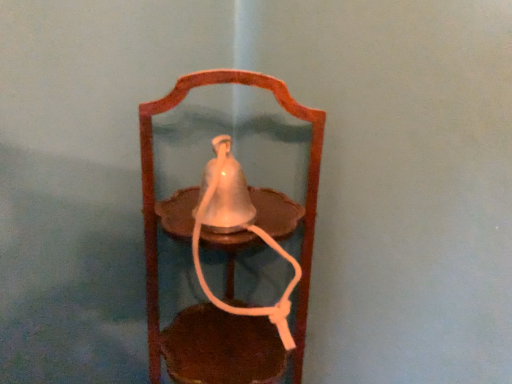
What do you see at coordinates (155, 198) in the screenshot? I see `matte white bell at center` at bounding box center [155, 198].

The image size is (512, 384). Find the location of `matte white bell at center`. matte white bell at center is located at coordinates (155, 198).

Locate an element on the screen. matte white bell at center is located at coordinates (155, 198).